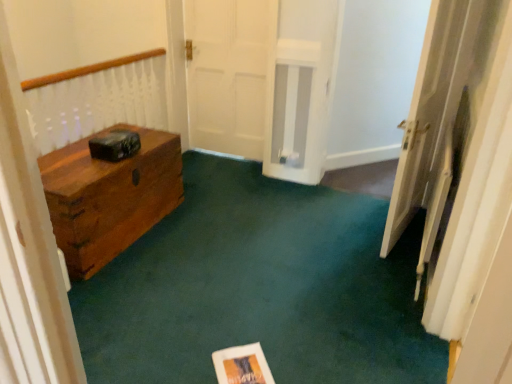
This screenshot has height=384, width=512. Find the location of `free spot above matte paper at center (from a real-world perspective)`. free spot above matte paper at center (from a real-world perspective) is located at coordinates (243, 362).